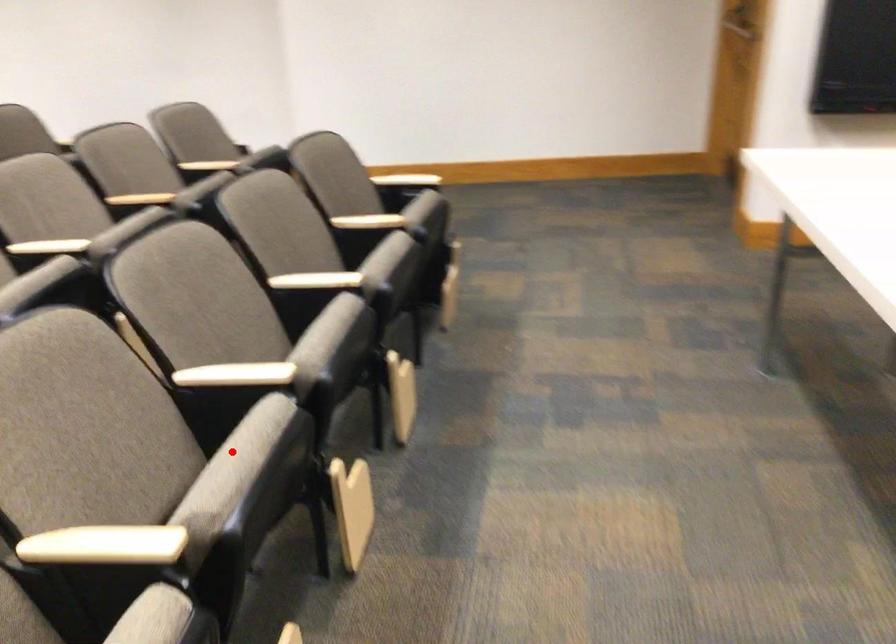
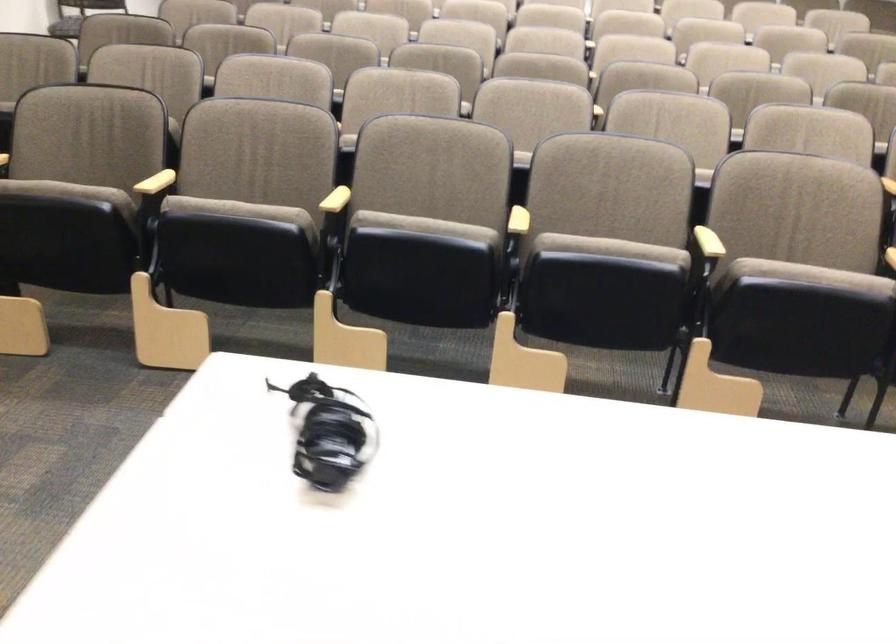
Where in the second image is the point corresponding to the highlighted location from the first image?

(424, 225)